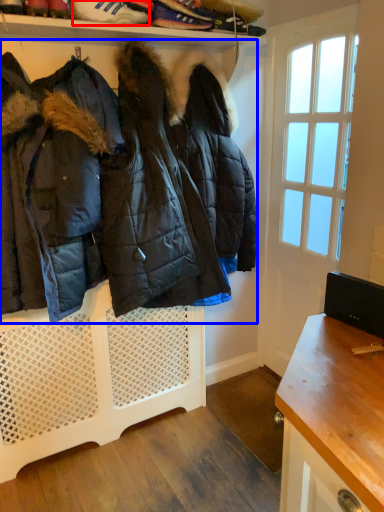
Question: Which object appears closest to the camera in this image, footwear (highlighted by a red box) or jacket (highlighted by a blue box)?

Choices:
 (A) footwear
 (B) jacket

Answer: (B)